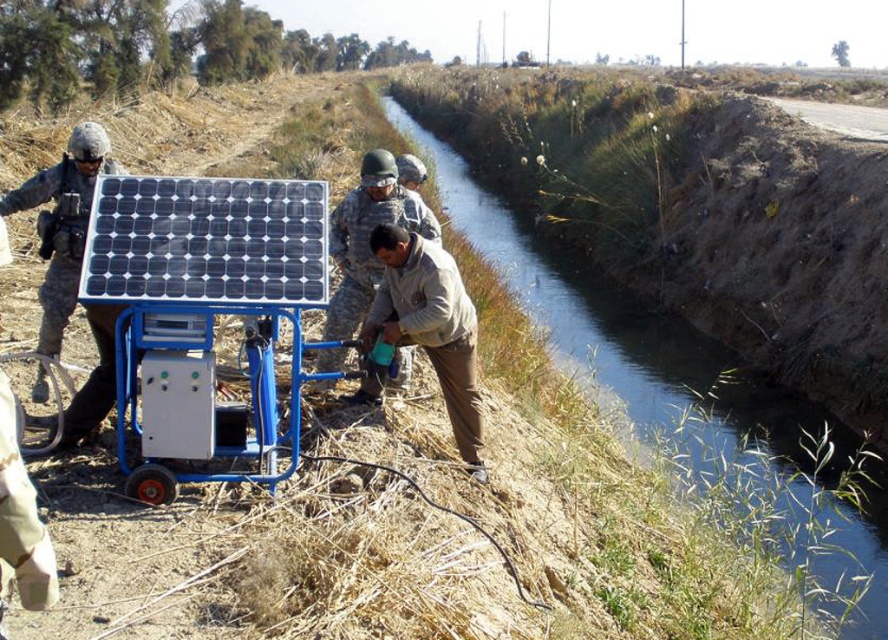
You are a hiker who needs to cross the canal using the green grassy bank at center and the matte black helmet at left as reference points. Which of these two objects is higher and would provide a better vantage point?

The green grassy bank at center has a greater height compared to the matte black helmet at left, so it would provide a better vantage point.

You are standing at the point closest to the cart. Which of the two points, point (345, 268) or point (54, 209), is farther away from you?

Point (345, 268) is farther away from you because it is behind point (54, 209), meaning it is located at a greater distance from your position.